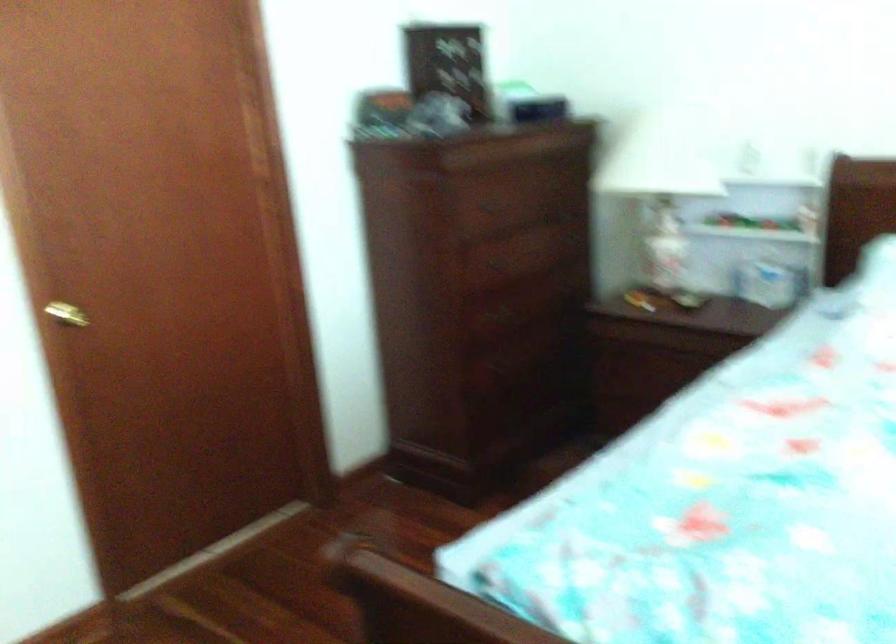
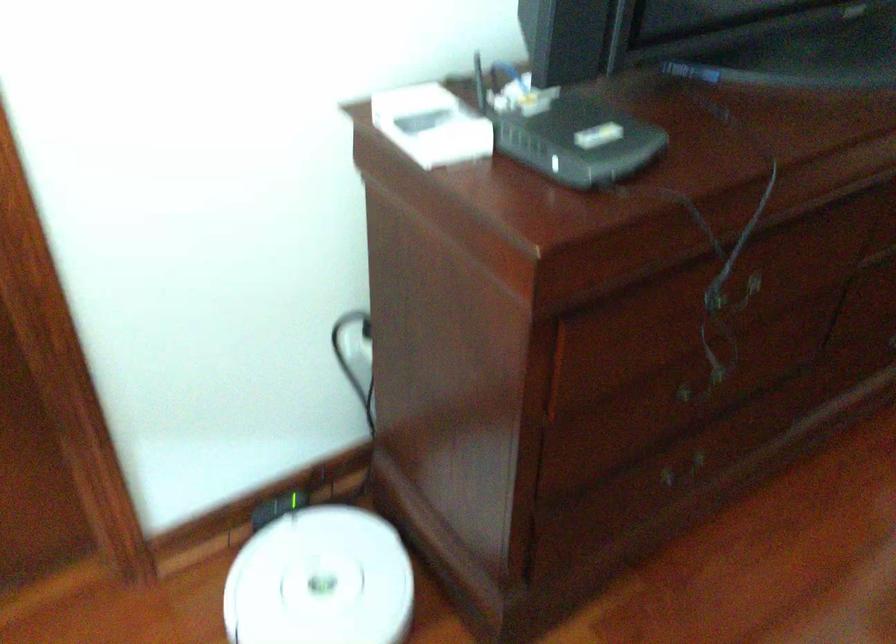
Looking at this image, the images are taken continuously from a first-person perspective. In which direction is your viewpoint rotating?

The camera's rotation is toward left-down.